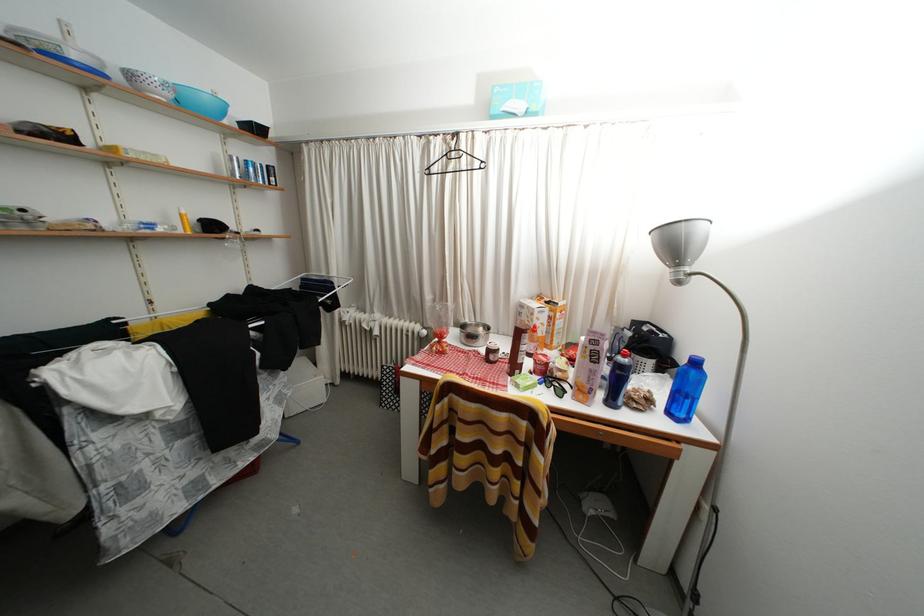
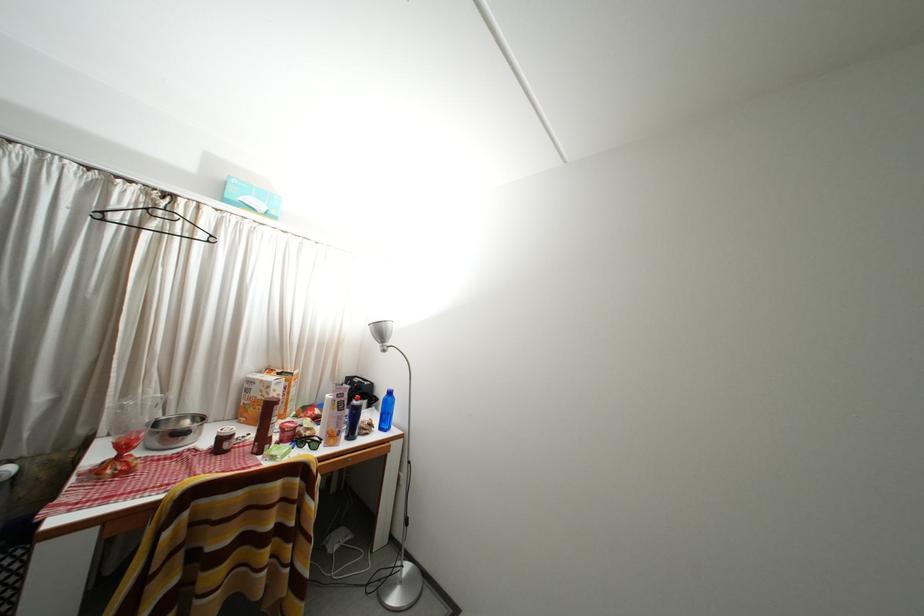
In the second image, find the point that corresponds to [566,379] in the first image.

(315, 439)